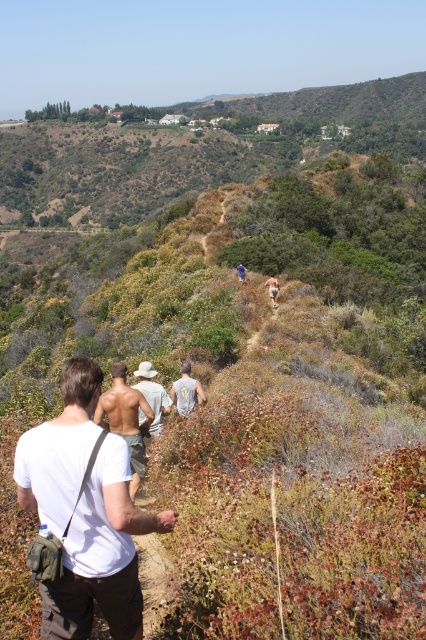
Question: Is white cotton shirt at center to the right of light gray shirt at center from the viewer's perspective?

Choices:
 (A) yes
 (B) no

Answer: (B)

Question: Does shiny metallic shorts at center have a greater width compared to tan woven hat at center?

Choices:
 (A) no
 (B) yes

Answer: (B)

Question: Which object is positioned farthest from the white cotton shirt at center?

Choices:
 (A) light gray shirt at center
 (B) blue fabric shirt at center

Answer: (B)

Question: Which object is farther from the camera taking this photo?

Choices:
 (A) light gray shirt at center
 (B) blue fabric shirt at center
 (C) tan woven hat at center

Answer: (B)

Question: Which point is farther to the camera?

Choices:
 (A) tan skin man at center
 (B) shiny metallic shorts at center
 (C) blue fabric shirt at center

Answer: (C)

Question: Is white cotton shirt at center positioned behind tan skin man at center?

Choices:
 (A) no
 (B) yes

Answer: (A)